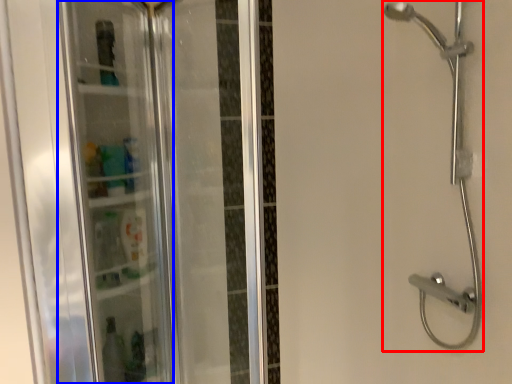
Question: Among these objects, which one is nearest to the camera, shower (highlighted by a red box) or screen door (highlighted by a blue box)?

Choices:
 (A) shower
 (B) screen door

Answer: (B)